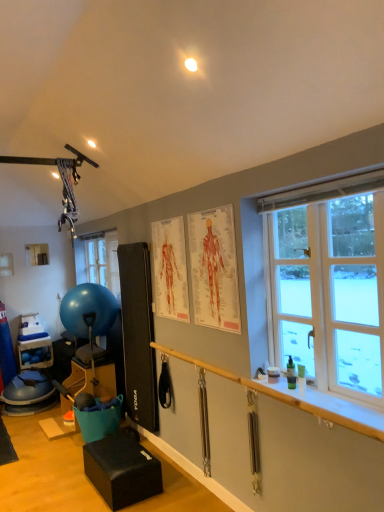
At what (x,y) coordinates should I click in order to perform the action: click on vacant point above white plastic window sill at lower right (from a real-world perspective). Please return your answer as a coordinate pair (x, y). Looking at the image, I should click on (322, 388).